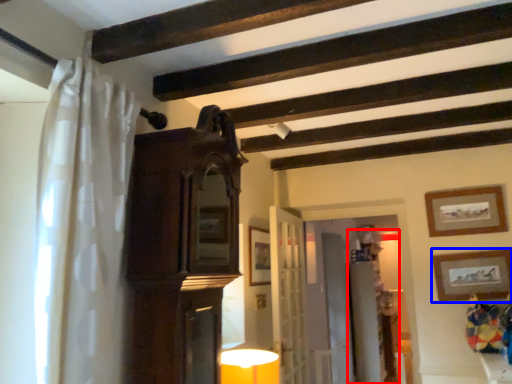
Question: Which point is further to the camera, dresser (highlighted by a red box) or picture frame (highlighted by a blue box)?

Choices:
 (A) dresser
 (B) picture frame

Answer: (A)